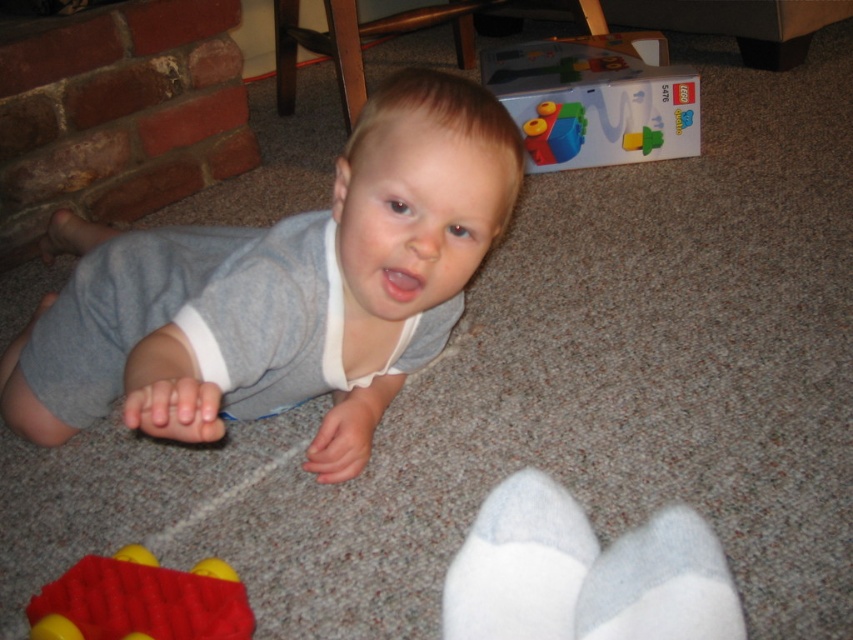
Question: Can you confirm if matte plastic toy at upper center is wider than rubberized red toy at lower left?

Choices:
 (A) yes
 (B) no

Answer: (A)

Question: Is white soft socks at lower center closer to the viewer compared to matte plastic toy at upper center?

Choices:
 (A) no
 (B) yes

Answer: (B)

Question: Is rubberized red toy at lower left smaller than translucent plastic blocks at upper center?

Choices:
 (A) yes
 (B) no

Answer: (B)

Question: Which object is farther from the camera taking this photo?

Choices:
 (A) gray cotton onesie at center
 (B) rubberized red toy at lower left
 (C) matte plastic toy at upper center
 (D) white soft socks at lower center

Answer: (C)

Question: Which object appears farthest from the camera in this image?

Choices:
 (A) matte plastic toy at upper center
 (B) translucent plastic blocks at upper center

Answer: (B)

Question: Which point appears closest to the camera in this image?

Choices:
 (A) [x=558, y=122]
 (B) [x=526, y=618]

Answer: (B)